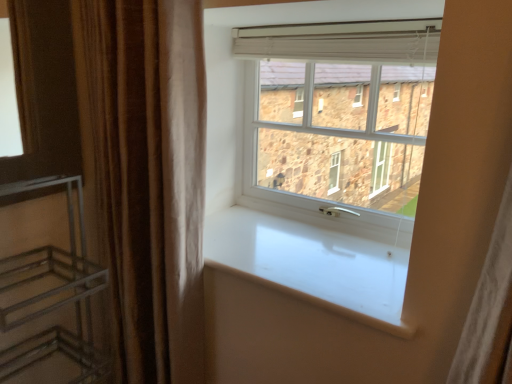
Question: From their relative heights in the image, would you say metallic silver shelf at left is taller or shorter than brown velvet curtain at left?

Choices:
 (A) short
 (B) tall

Answer: (A)

Question: Does point (3, 331) appear closer or farther from the camera than point (152, 357)?

Choices:
 (A) closer
 (B) farther

Answer: (A)

Question: Which object is positioned closest to the white plastic window at center?

Choices:
 (A) brown velvet curtain at left
 (B) white glossy window sill at center
 (C) metallic silver shelf at left

Answer: (B)

Question: Estimate the real-world distances between objects in this image. Which object is farther from the metallic silver shelf at left?

Choices:
 (A) white plastic window at center
 (B) white glossy window sill at center
 (C) brown velvet curtain at left

Answer: (A)